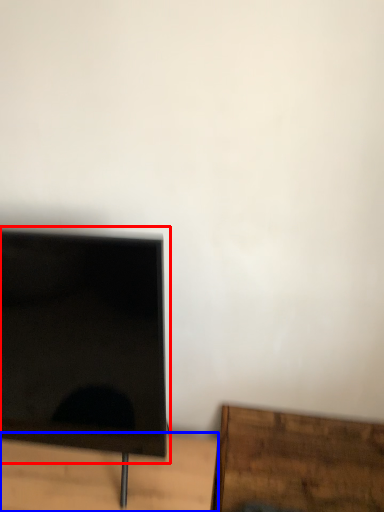
Question: Which of the following is the closest to the observer, computer monitor (highlighted by a red box) or table (highlighted by a blue box)?

Choices:
 (A) computer monitor
 (B) table

Answer: (A)